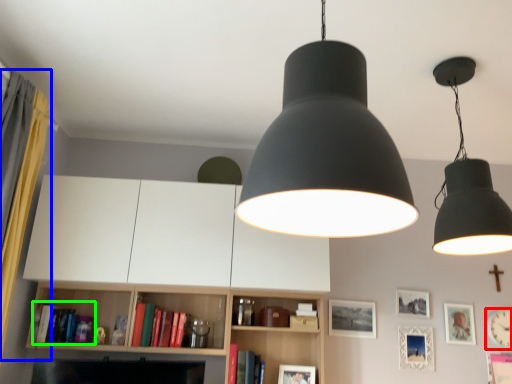
Question: Based on their relative distances, which object is farther from clock (highlighted by a red box)? Choose from curtain (highlighted by a blue box) and book (highlighted by a green box).

Choices:
 (A) curtain
 (B) book

Answer: (A)